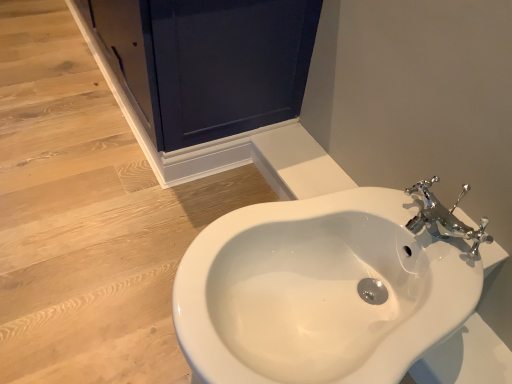
Question: Looking at their shapes, would you say white glossy sink at center is wider or thinner than matte dark blue screen door at upper left?

Choices:
 (A) wide
 (B) thin

Answer: (A)

Question: Which is correct: white glossy sink at center is inside matte dark blue screen door at upper left, or outside of it?

Choices:
 (A) outside
 (B) inside

Answer: (A)

Question: Is point (204, 377) closer or farther from the camera than point (182, 23)?

Choices:
 (A) closer
 (B) farther

Answer: (A)

Question: Do you think matte dark blue screen door at upper left is within white glossy sink at center, or outside of it?

Choices:
 (A) outside
 (B) inside

Answer: (A)

Question: Looking at the image, does matte dark blue screen door at upper left seem bigger or smaller compared to white glossy sink at center?

Choices:
 (A) big
 (B) small

Answer: (A)

Question: Looking at their shapes, would you say matte dark blue screen door at upper left is wider or thinner than white glossy sink at center?

Choices:
 (A) wide
 (B) thin

Answer: (B)

Question: In terms of height, does matte dark blue screen door at upper left look taller or shorter compared to white glossy sink at center?

Choices:
 (A) tall
 (B) short

Answer: (A)